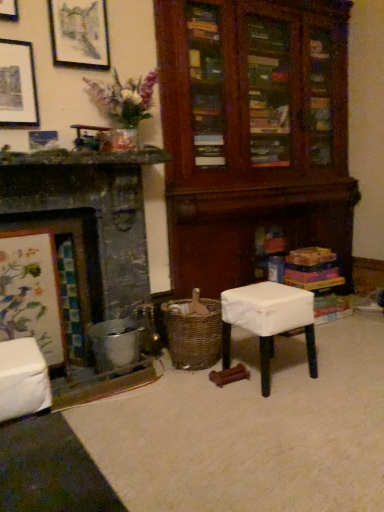
Where is `vacant area that is in front of white fabric-covered stool at center`? vacant area that is in front of white fabric-covered stool at center is located at coordinates (278, 408).